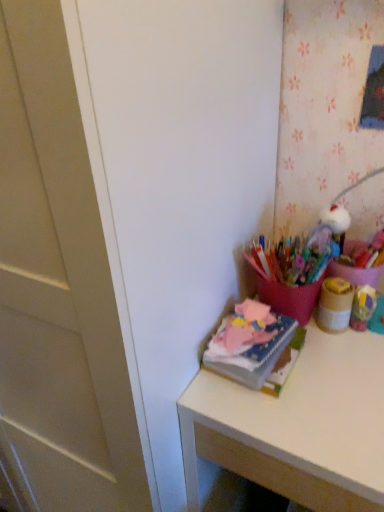
Question: Should I look upward or downward to see matte pink desk at right?

Choices:
 (A) down
 (B) up

Answer: (A)

Question: Does matte pink desk at right turn towards matte brown jar at upper right?

Choices:
 (A) yes
 (B) no

Answer: (B)

Question: Would you say matte pink desk at right is a long distance from matte brown jar at upper right?

Choices:
 (A) no
 (B) yes

Answer: (A)

Question: Is matte pink desk at right wider than matte brown jar at upper right?

Choices:
 (A) yes
 (B) no

Answer: (A)

Question: From a real-world perspective, is matte pink desk at right on top of matte brown jar at upper right?

Choices:
 (A) yes
 (B) no

Answer: (B)

Question: Is matte pink desk at right at the right side of matte brown jar at upper right?

Choices:
 (A) no
 (B) yes

Answer: (A)

Question: Considering the relative positions of matte pink desk at right and matte brown jar at upper right in the image provided, is matte pink desk at right to the left of matte brown jar at upper right from the viewer's perspective?

Choices:
 (A) yes
 (B) no

Answer: (A)

Question: Is soft pink fabric at upper right placed right next to matte pink desk at right?

Choices:
 (A) yes
 (B) no

Answer: (B)

Question: Is matte pink desk at right surrounded by soft pink fabric at upper right?

Choices:
 (A) yes
 (B) no

Answer: (B)

Question: Is soft pink fabric at upper right not inside matte pink desk at right?

Choices:
 (A) yes
 (B) no

Answer: (A)

Question: Does soft pink fabric at upper right have a greater height compared to matte pink desk at right?

Choices:
 (A) yes
 (B) no

Answer: (B)

Question: From the image's perspective, does soft pink fabric at upper right appear lower than matte pink desk at right?

Choices:
 (A) no
 (B) yes

Answer: (A)

Question: Would you consider soft pink fabric at upper right to be distant from matte pink desk at right?

Choices:
 (A) yes
 (B) no

Answer: (B)

Question: From the image's perspective, would you say matte brown jar at upper right is shown under soft pink fabric at upper right?

Choices:
 (A) no
 (B) yes

Answer: (A)